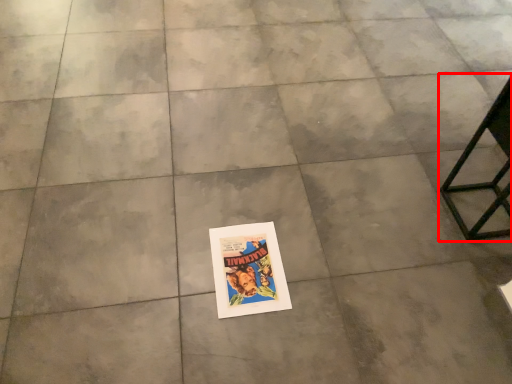
Question: Where is furniture (annotated by the red box) located in relation to poster in the image?

Choices:
 (A) right
 (B) left

Answer: (A)